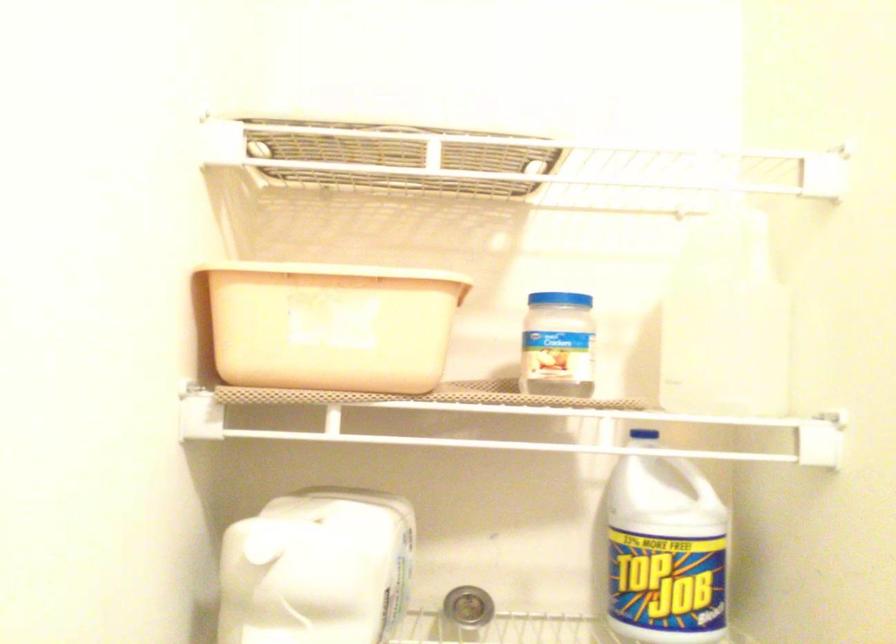
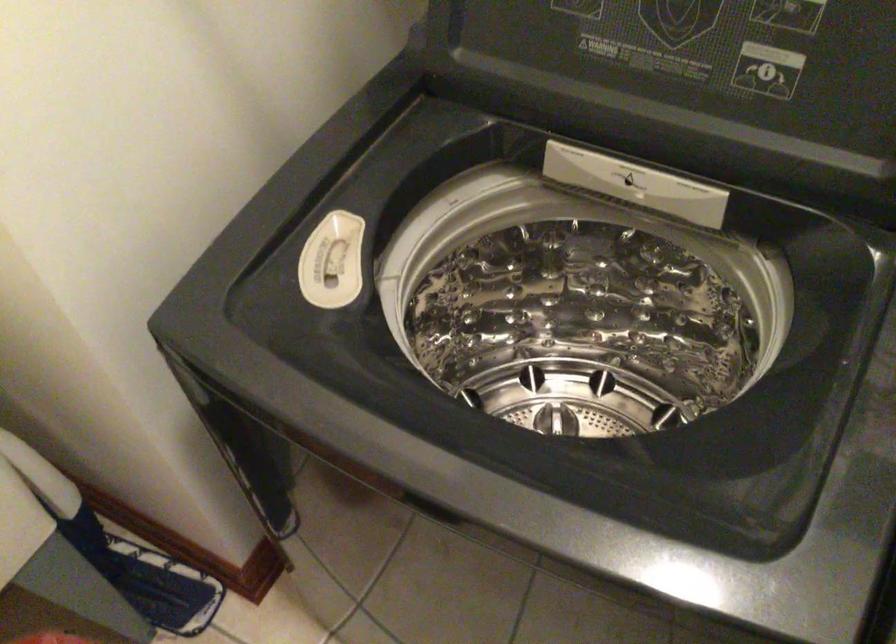
From the picture: Based on the continuous images, in which direction is the camera rotating?

The camera's rotation is toward right-down.